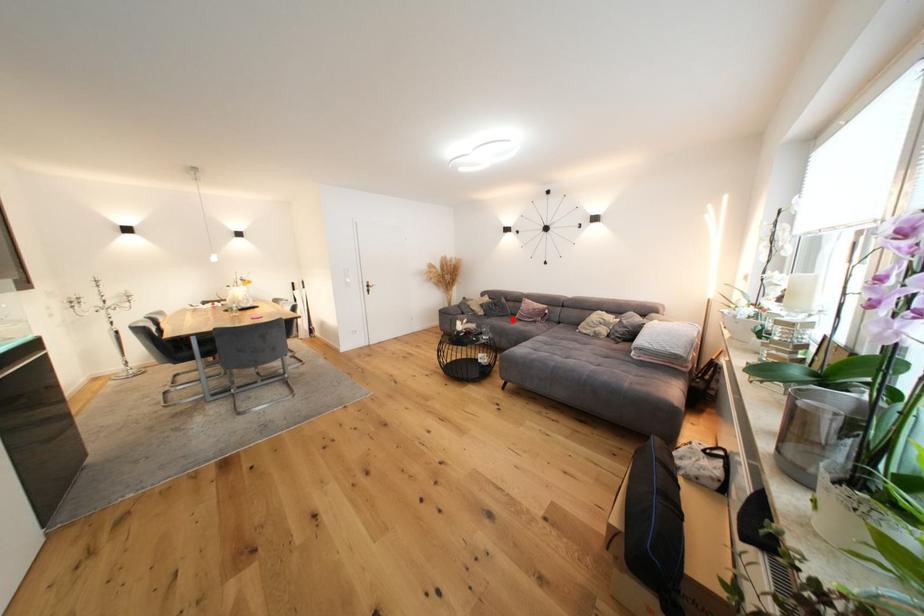
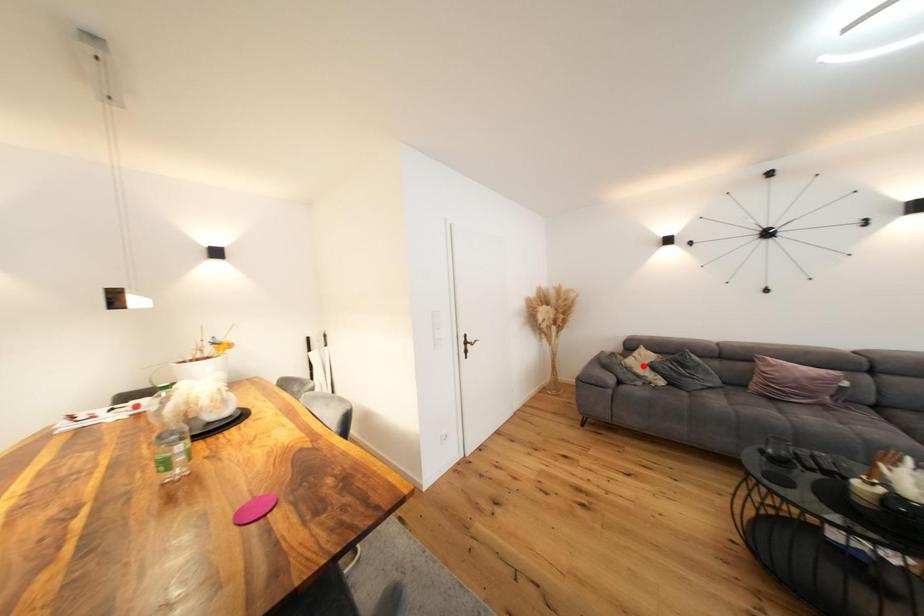
I am providing you with two images of the same scene from different viewpoints. A red point is marked on the first image and another point is marked on the second image. Does the point marked in image1 correspond to the same location as the one in image2?

No